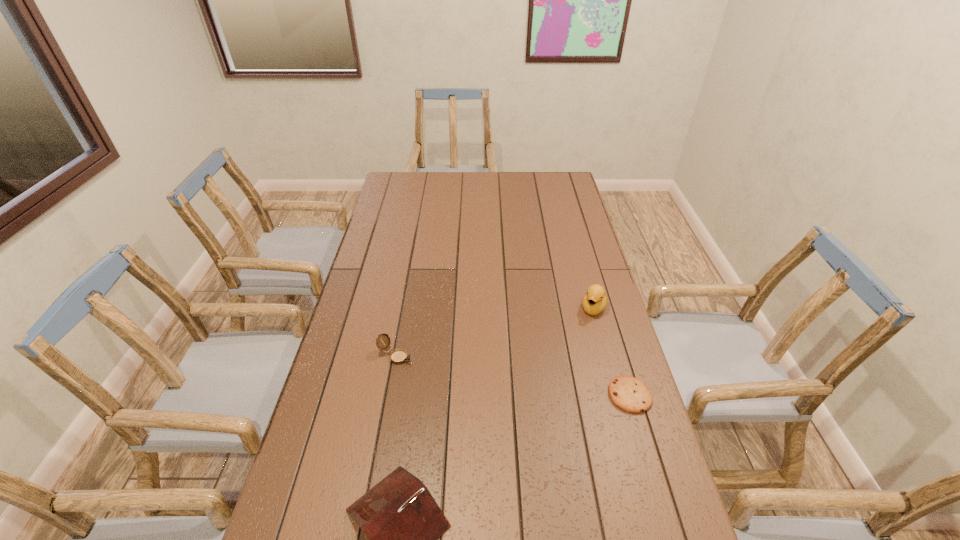
The width and height of the screenshot is (960, 540). What are the coordinates of `blank area at the near right corner` in the screenshot? It's located at (655, 524).

Where is `vacant space in between the compass and the duckling`? Image resolution: width=960 pixels, height=540 pixels. vacant space in between the compass and the duckling is located at coordinates (495, 332).

Identify the location of free space between the compass and the shortest object. Image resolution: width=960 pixels, height=540 pixels. (513, 375).

The width and height of the screenshot is (960, 540). Identify the location of free area in between the duckling and the compass. (495, 332).

Identify which object is the third nearest to the nearest object. Please provide its 2D coordinates. Your answer should be formatted as a tuple, i.e. [(x, y)], where the tuple contains the x and y coordinates of a point satisfying the conditions above.

[(595, 300)]

Where is `object that stands as the third closest to the farthest object`? The image size is (960, 540). object that stands as the third closest to the farthest object is located at coordinates (403, 522).

What are the coordinates of `vacant space that satisfies the following two spatial constraints: 1. on the back side of the compass; 2. on the left side of the duckling` in the screenshot? It's located at (405, 308).